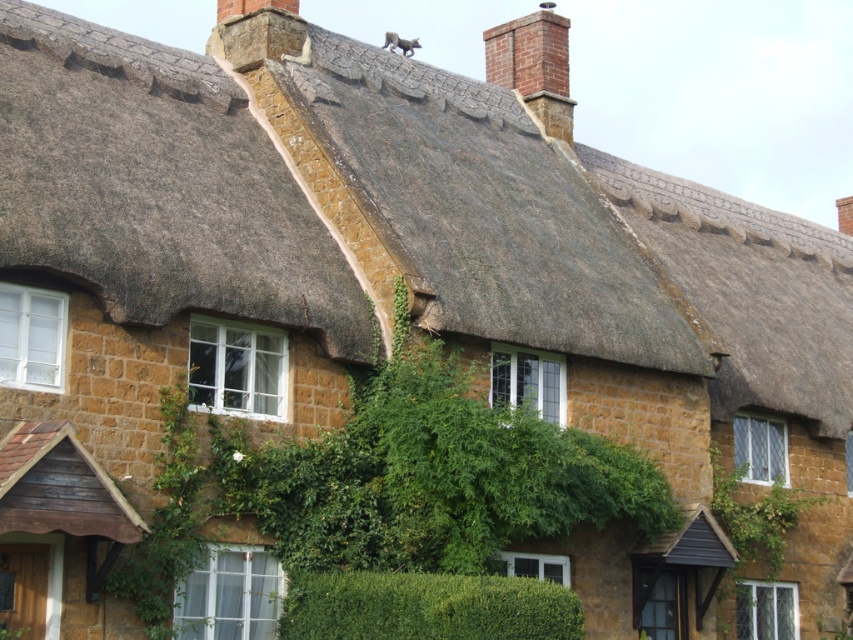
Between thatched roof at upper center and green leafy hedge at center, which one is positioned lower?

green leafy hedge at center is below.

Between thatched roof at upper center and green leafy hedge at center, which one appears on the right side from the viewer's perspective?

thatched roof at upper center

What do you see at coordinates (486, 209) in the screenshot?
I see `thatched roof at upper center` at bounding box center [486, 209].

Where is `thatched roof at upper center`? The width and height of the screenshot is (853, 640). thatched roof at upper center is located at coordinates (486, 209).

Does brown thatch at center have a greater width compared to thatched straw roof at upper center?

No, brown thatch at center is not wider than thatched straw roof at upper center.

Is point (15, 124) closer to camera compared to point (746, 266)?

Yes.

You are a GUI agent. You are given a task and a screenshot of the screen. Output one action in this format:
    pyautogui.click(x=<x>, y=<y>)
    Task: Click on the brown thatch at center
    The height and width of the screenshot is (640, 853).
    Given the screenshot: What is the action you would take?
    pyautogui.click(x=155, y=186)

Which is above, brown thatch at center or thatched roof at upper center?

thatched roof at upper center

Does point (48, 198) come closer to viewer compared to point (503, 88)?

Yes, it is in front of point (503, 88).

Identify the location of brown thatch at center. (155, 186).